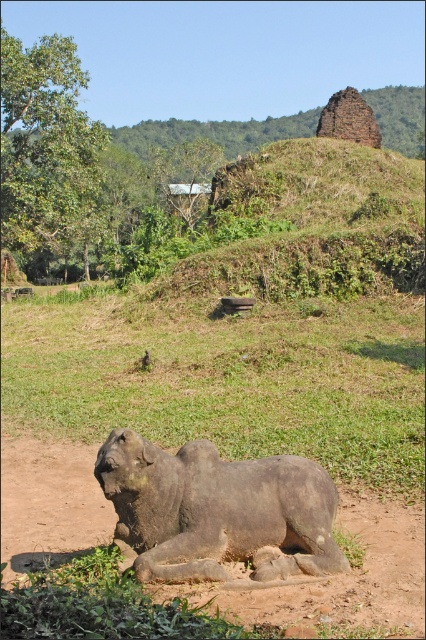
Question: Can you confirm if green grass at lower center is positioned above gray stone elephant at lower center?

Choices:
 (A) yes
 (B) no

Answer: (A)

Question: Which of the following is the farthest from the observer?

Choices:
 (A) (74, 320)
 (B) (270, 500)

Answer: (A)

Question: Among these points, which one is farthest from the camera?

Choices:
 (A) (155, 492)
 (B) (383, 452)

Answer: (B)

Question: Does green grass at lower center have a larger size compared to gray stone elephant at lower center?

Choices:
 (A) yes
 (B) no

Answer: (A)

Question: Which of the following is the closest to the observer?

Choices:
 (A) (132, 401)
 (B) (296, 544)

Answer: (B)

Question: Where is green grass at lower center located in relation to gray stone elephant at lower center in the image?

Choices:
 (A) above
 (B) below

Answer: (A)